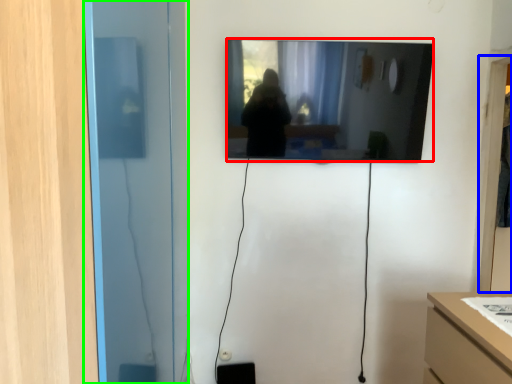
Question: Which object is positioned closest to mirror (highlighted by a red box)? Select from glass door (highlighted by a blue box) and glass door (highlighted by a green box).

Choices:
 (A) glass door
 (B) glass door

Answer: (A)